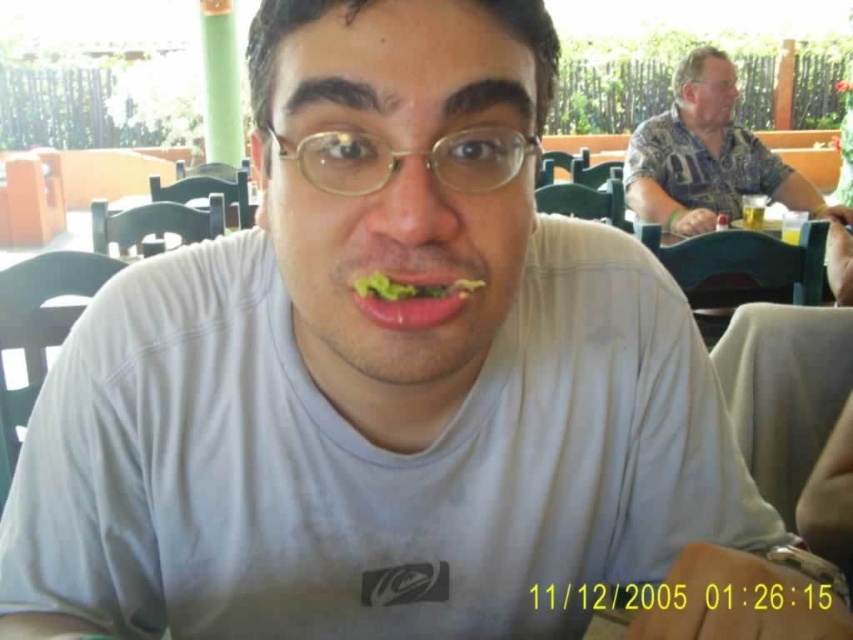
You are a photographer standing at the center of the scene. You want to take a photo of the hawaiian shirt at upper right and the green leafy lettuce at center so that both are clearly visible. Given that your camera has a maximum focus range of 7.5 feet, will you be able to capture both subjects in focus?

The hawaiian shirt at upper right is 8.00 feet from green leafy lettuce at center. Since the distance between them exceeds the camera maximum focus range of 7.5 feet, you cannot capture both subjects in focus.

You are a photographer trying to capture a candid shot of the person with the green leafy lettuce at center. To avoid including the hawaiian shirt at upper right in the frame, should you adjust your camera angle upwards or downwards?

The hawaiian shirt at upper right is above the green leafy lettuce at center. To exclude it from the frame, you should adjust your camera angle downwards.